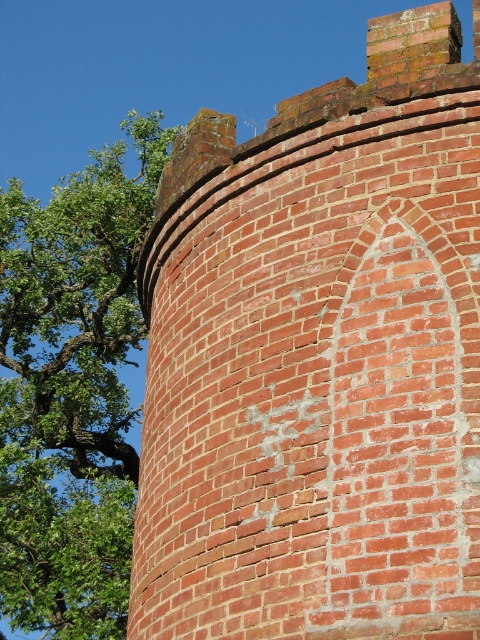
You are standing at point [140,268] and want to walk to the arched opening. The distance between you and the arched opening is 33.76 meters. If you walk at a speed of 1.5 meters per second, how many seconds will it take you to reach the arched opening?

The distance between you and the arched opening is 33.76 meters. At a speed of 1.5 meters per second, it will take 33.76 divided by 1.5, which equals approximately 22.5 seconds to reach the arched opening.

You are standing in front of the scene and want to know if the red brick wall at center is blocking your view of the green leafy tree at upper left. Can you see the tree through the wall?

The red brick wall at center is positioned over green leafy tree at upper left, so the wall is blocking the view of the green leafy tree at upper left. You cannot see the tree through the wall.

You are an architect analyzing the image. You need to determine which object occupies a larger area in the scene. Based on the red brick wall at center and the green leafy tree at upper left, which one is bigger?

The green leafy tree at upper left is larger than the red brick wall at center.